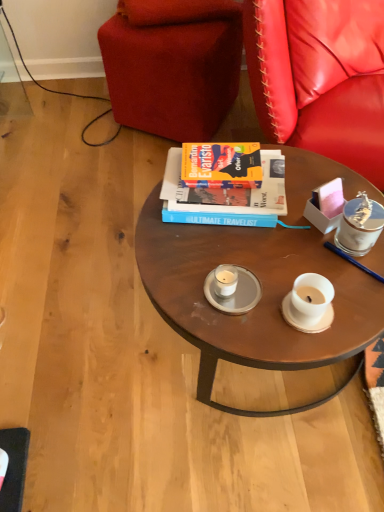
Locate an element on the screen. The height and width of the screenshot is (512, 384). vacant space positioned to the left of white matte candle at center, acting as the second coffee cup starting from the right is located at coordinates (180, 279).